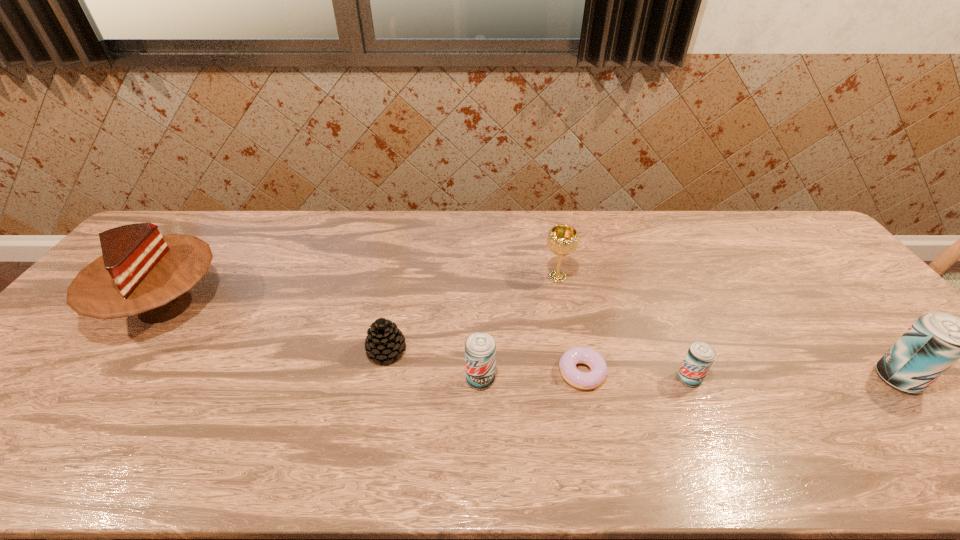
The width and height of the screenshot is (960, 540). Find the location of `object that is positioned at the near right corner`. object that is positioned at the near right corner is located at coordinates (936, 340).

Locate an element on the screen. vacant space at the far edge of the desktop is located at coordinates (666, 211).

In the image, there is a desktop. What are the coordinates of `vacant space at the near edge` in the screenshot? It's located at (697, 412).

Find the location of a particular element. The height and width of the screenshot is (540, 960). free space at the right edge of the desktop is located at coordinates (879, 379).

Image resolution: width=960 pixels, height=540 pixels. In the image, there is a desktop. What are the coordinates of `vacant space at the far right corner` in the screenshot? It's located at (745, 213).

Locate an element on the screen. This screenshot has height=540, width=960. vacant space that is in between the chalice and the tallest beer can is located at coordinates (728, 328).

The height and width of the screenshot is (540, 960). What are the coordinates of `free space between the chalice and the rightmost beer can` in the screenshot? It's located at (728, 328).

At what (x,y) coordinates should I click in order to perform the action: click on free space that is in between the shortest beer can and the doughnut. Please return your answer as a coordinate pair (x, y). Looking at the image, I should click on (636, 376).

This screenshot has width=960, height=540. I want to click on free point between the second beer can from right to left and the shortest object, so click(x=636, y=376).

Locate an element on the screen. free point between the shortest beer can and the tallest beer can is located at coordinates (793, 379).